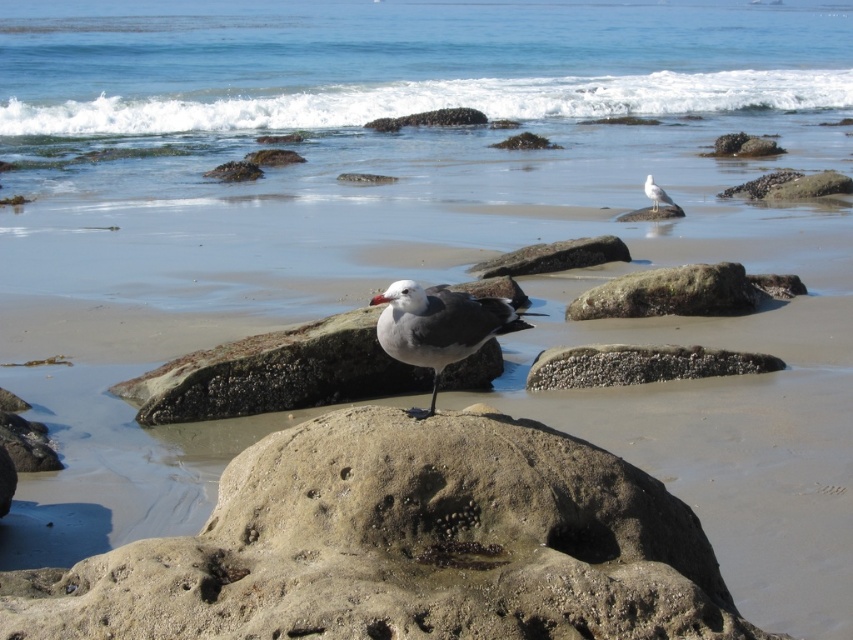
Does gray matte seagull at center have a smaller size compared to smooth sandstone rock at center?

Indeed, gray matte seagull at center has a smaller size compared to smooth sandstone rock at center.

Is point (392, 355) behind point (602, 371)?

That is False.

Where is `gray matte seagull at center`? Image resolution: width=853 pixels, height=640 pixels. gray matte seagull at center is located at coordinates (438, 326).

Can you confirm if blue water at upper center is wider than smooth sandstone rock at center?

Yes.

Does blue water at upper center appear over smooth sandstone rock at center?

Yes.

Is point (379, 77) positioned before point (722, 371)?

No, (379, 77) is behind (722, 371).

The height and width of the screenshot is (640, 853). Find the location of `blue water at upper center`. blue water at upper center is located at coordinates (405, 84).

Does point (442, 369) come behind point (779, 179)?

No.

Who is higher up, gray matte seagull at center or smooth gray rock at upper right?

Positioned higher is smooth gray rock at upper right.

Does point (451, 304) come behind point (822, 177)?

That is False.

Image resolution: width=853 pixels, height=640 pixels. Identify the location of gray matte seagull at center. (438, 326).